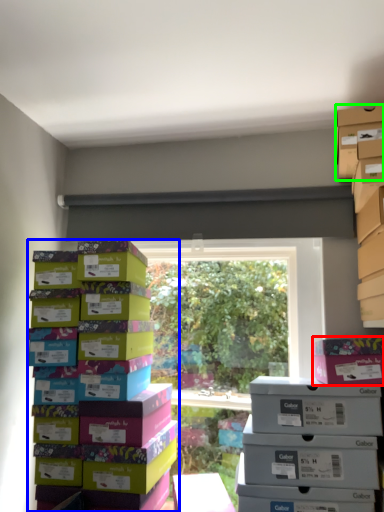
Question: Considering the real-world distances, which object is farthest from cardboard box (highlighted by a red box)? box (highlighted by a blue box) or storage box (highlighted by a green box)?

Choices:
 (A) box
 (B) storage box

Answer: (A)